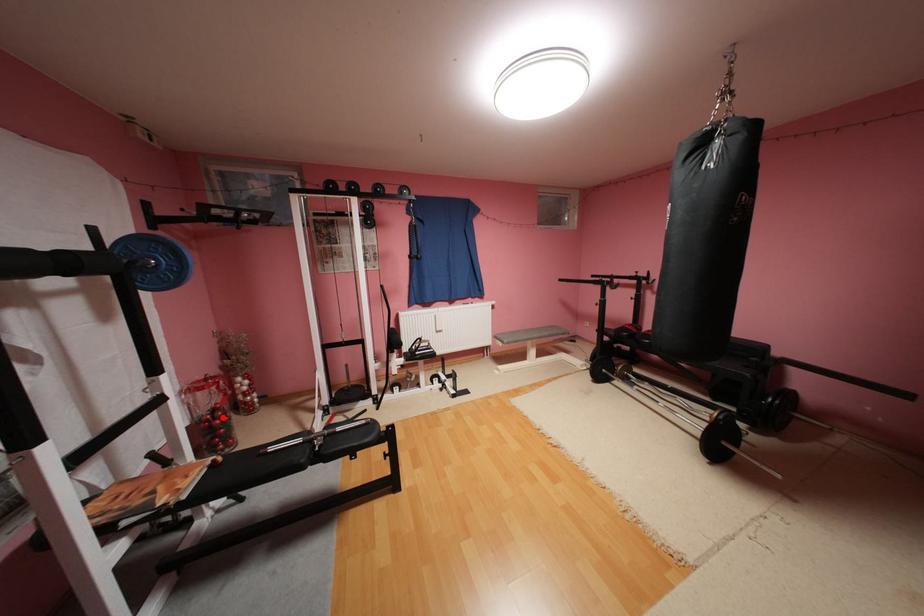
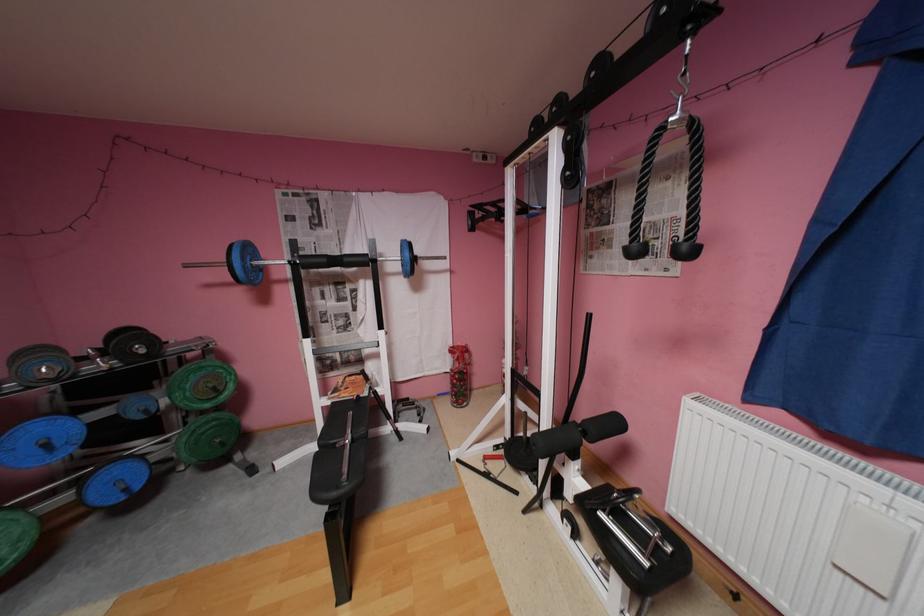
Where in the second image is the point corresponding to the highlighted location from the first image?

(462, 377)